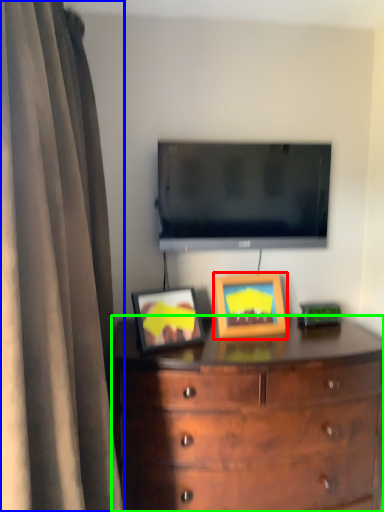
Question: Considering the real-world distances, which object is farthest from picture frame (highlighted by a red box)? curtain (highlighted by a blue box) or chest of drawers (highlighted by a green box)?

Choices:
 (A) curtain
 (B) chest of drawers

Answer: (A)